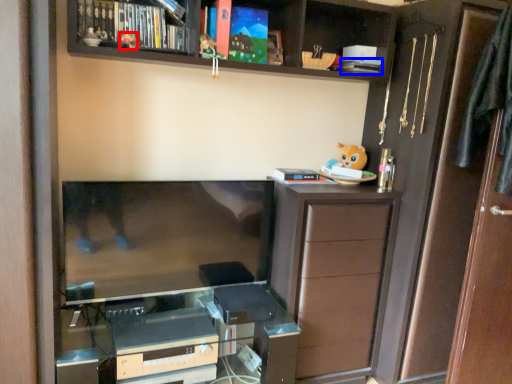
Question: Among these objects, which one is farthest to the camera, toy (highlighted by a red box) or book (highlighted by a blue box)?

Choices:
 (A) toy
 (B) book

Answer: (B)